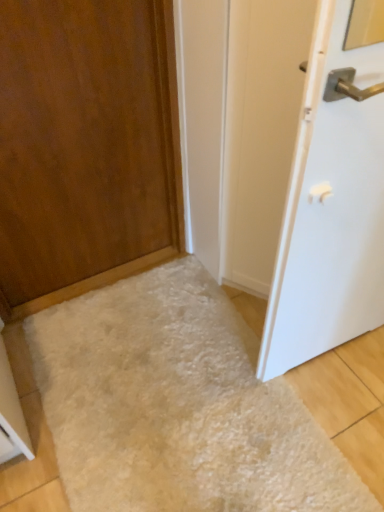
Question: Considering the relative positions of white fluffy rug at lower center and wooden door at left, the first door in the left-to-right sequence, in the image provided, is white fluffy rug at lower center in front of wooden door at left, the first door in the left-to-right sequence,?

Choices:
 (A) yes
 (B) no

Answer: (B)

Question: From a real-world perspective, is white fluffy rug at lower center on wooden door at left, the second door in the right-to-left sequence?

Choices:
 (A) yes
 (B) no

Answer: (B)

Question: Is white fluffy rug at lower center taller than wooden door at left, the first door in the left-to-right sequence?

Choices:
 (A) no
 (B) yes

Answer: (A)

Question: From a real-world perspective, is white fluffy rug at lower center positioned under wooden door at left, the first door in the left-to-right sequence, based on gravity?

Choices:
 (A) no
 (B) yes

Answer: (B)

Question: Is white fluffy rug at lower center surrounding wooden door at left, the first door in the left-to-right sequence?

Choices:
 (A) no
 (B) yes

Answer: (A)

Question: Can you confirm if white fluffy rug at lower center is positioned to the left of wooden door at left, the second door in the right-to-left sequence?

Choices:
 (A) no
 (B) yes

Answer: (A)

Question: Is wooden door at left, the first door in the left-to-right sequence, at the back of white glossy door at right, positioned as the 1th door in right-to-left order?

Choices:
 (A) yes
 (B) no

Answer: (B)

Question: Does white glossy door at right, positioned as the 1th door in right-to-left order, lie behind wooden door at left, the first door in the left-to-right sequence?

Choices:
 (A) no
 (B) yes

Answer: (A)

Question: Can you confirm if white glossy door at right, which is the second door from left to right, is taller than wooden door at left, the first door in the left-to-right sequence?

Choices:
 (A) no
 (B) yes

Answer: (B)

Question: From a real-world perspective, is white glossy door at right, positioned as the 1th door in right-to-left order, beneath wooden door at left, the second door in the right-to-left sequence?

Choices:
 (A) no
 (B) yes

Answer: (A)

Question: Is white glossy door at right, positioned as the 1th door in right-to-left order, not near wooden door at left, the first door in the left-to-right sequence?

Choices:
 (A) yes
 (B) no

Answer: (B)

Question: Is white glossy door at right, which is the second door from left to right, to the right of wooden door at left, the first door in the left-to-right sequence, from the viewer's perspective?

Choices:
 (A) no
 (B) yes

Answer: (B)

Question: Considering the relative positions of wooden door at left, the first door in the left-to-right sequence, and white fluffy rug at lower center in the image provided, is wooden door at left, the first door in the left-to-right sequence, behind white fluffy rug at lower center?

Choices:
 (A) no
 (B) yes

Answer: (A)